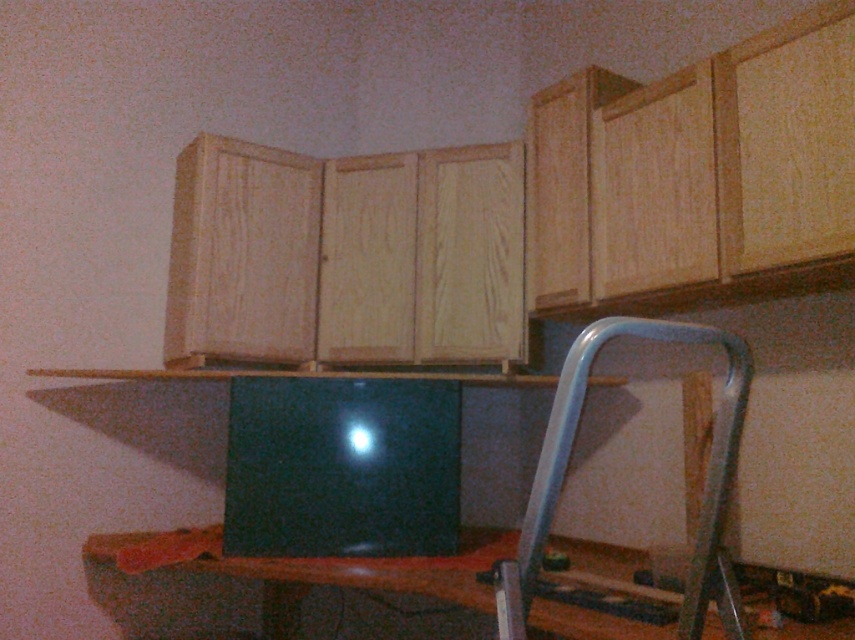
You are organizing a meeting in the kitchen and need to place a name tag on the black glossy laptop at center. Where should you place it so that it is visible from the metallic silver chair at lower right?

The black glossy laptop at center is to the left of the metallic silver chair at lower right, so placing the name tag on the right side of the black glossy laptop at center would make it visible from the metallic silver chair at lower right.

You are a delivery person who needs to place a 60 cm wide box on the wooden table at center. Can you fit the box on the table without it overlapping the metallic silver chair at lower right?

The wooden table at center and metallic silver chair at lower right are 55.37 centimeters apart. Since the box is 60 cm wide, it would overlap the chair if placed on the table.

You are standing in the kitchen and want to reach a point that is 2 meters away from you. Can you confirm if the point at coordinates point (374, 470) is exactly 2 meters away from your current position?

The distance of point (374, 470) from camera is 2.02 meters, so the point is slightly more than 2 meters away from your current position.